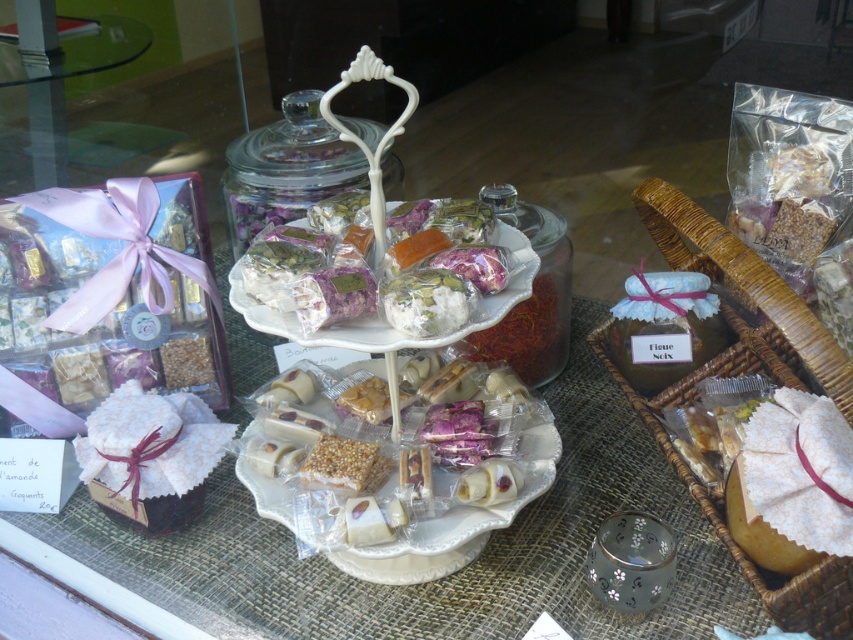
You are a customer who wants to buy a gift for a friend. You see the woven brown basket at right and the transparent glass jar at center. Which item can hold more confectionery items based on their sizes?

The woven brown basket at right is bigger than the transparent glass jar at center, so it can hold more confectionery items.

Consider the image. You are a customer at the confectionery shop and want to pick up the transparent glass jar at center and the woven brown basket at right. Which one do you need to reach further to grab?

The transparent glass jar at center is further away from you than the woven brown basket at right, so you need to reach further to grab the transparent glass jar at center.

In the scene shown: You are a customer at the confectionery shop and want to choose between the transparent glass jar at center and the translucent glass saffron at center. Which one has a wider opening to place your hand inside?

The transparent glass jar at center has a wider opening than the translucent glass saffron at center, so it allows easier hand placement inside.